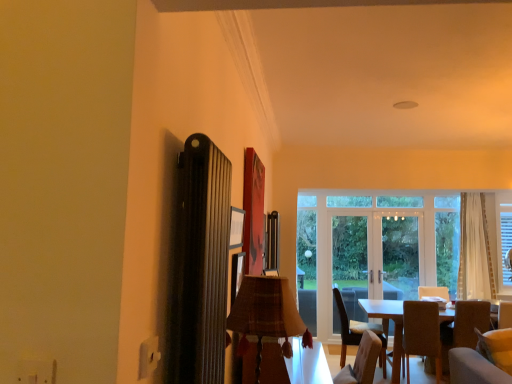
In order to click on plaid fabric lampshade at center in this screenshot , I will do 266,326.

Measure the distance between brown fabric chair at lower right, which is counted as the second chair, starting from the right, and camera.

The distance of brown fabric chair at lower right, which is counted as the second chair, starting from the right, from camera is 4.60 meters.

What is the approximate height of clear glass door at center, which is the first screen door in right-to-left order?

clear glass door at center, which is the first screen door in right-to-left order, is 2.08 meters in height.

In the scene shown: Measure the distance between point (498, 357) and camera.

The distance of point (498, 357) from camera is 11.61 feet.

In order to click on plaid fabric lampshade at center in this screenshot , I will do `click(266, 326)`.

Is plaid fabric lampshade at center located outside white sheer curtain at right?

Indeed, plaid fabric lampshade at center is completely outside white sheer curtain at right.

Is plaid fabric lampshade at center facing away from white sheer curtain at right?

No, plaid fabric lampshade at center is not facing the opposite direction of white sheer curtain at right.

Does point (262, 331) lie in front of point (472, 208)?

Yes, point (262, 331) is in front of point (472, 208).

The height and width of the screenshot is (384, 512). In order to click on curtain on the right of plaid fabric lampshade at center in this screenshot , I will do `click(474, 250)`.

Is there a large distance between soft beige fabric armchair at lower right and clear glass door at center, which is the second screen door from right to left?

Absolutely, soft beige fabric armchair at lower right is distant from clear glass door at center, which is the second screen door from right to left.

From the picture: How far apart are soft beige fabric armchair at lower right and clear glass door at center, which is the second screen door from right to left?

soft beige fabric armchair at lower right is 1.42 meters away from clear glass door at center, which is the second screen door from right to left.

From the picture: Which is in front, soft beige fabric armchair at lower right or clear glass door at center, which is the second screen door from right to left?

soft beige fabric armchair at lower right is in front.

Which object is wider, soft beige fabric armchair at lower right or clear glass door at center, which is counted as the 1th screen door, starting from the left?

soft beige fabric armchair at lower right.

The image size is (512, 384). Identify the location of couch lying in front of the clear glass door at center, which is the first screen door in right-to-left order. (484, 360).

Can you confirm if clear glass door at center, the 2th screen door viewed from the left, is smaller than velvet beige couch at lower right?

No, clear glass door at center, the 2th screen door viewed from the left, is not smaller than velvet beige couch at lower right.

From the image's perspective, is clear glass door at center, the 2th screen door viewed from the left, on top of velvet beige couch at lower right?

Yes, from the image's perspective, clear glass door at center, the 2th screen door viewed from the left, is over velvet beige couch at lower right.

Does point (414, 292) lie in front of point (463, 380)?

No.

Could you measure the distance between transparent glass window at center and clear glass door at center, which is counted as the 1th screen door, starting from the left?

1.14 meters.

Looking at this image, from a real-world perspective, is transparent glass window at center positioned over clear glass door at center, which is counted as the 1th screen door, starting from the left, based on gravity?

Indeed, from a real-world perspective, transparent glass window at center stands above clear glass door at center, which is counted as the 1th screen door, starting from the left.

Would you say transparent glass window at center is outside clear glass door at center, which is the second screen door from right to left?

Yes, transparent glass window at center is located beyond the bounds of clear glass door at center, which is the second screen door from right to left.

Based on their sizes in the image, would you say transparent glass window at center is bigger or smaller than clear glass door at center, which is counted as the 1th screen door, starting from the left?

Clearly, transparent glass window at center is smaller in size than clear glass door at center, which is counted as the 1th screen door, starting from the left.

Is plaid fabric lampshade at center not within transparent glass window at center?

plaid fabric lampshade at center lies outside transparent glass window at center's area.

From the image's perspective, would you say plaid fabric lampshade at center is positioned over transparent glass window at center?

Indeed, from the image's perspective, plaid fabric lampshade at center is shown above transparent glass window at center.

Is transparent glass window at center at the back of plaid fabric lampshade at center?

No.

From the picture: How different are the orientations of plaid fabric lampshade at center and transparent glass window at center in degrees?

93.5 degrees separate the facing orientations of plaid fabric lampshade at center and transparent glass window at center.

Visually, is transparent glass window at center positioned to the left or to the right of velvet beige couch at lower right?

Based on their positions, transparent glass window at center is located to the right of velvet beige couch at lower right.

From a real-world perspective, is transparent glass window at center physically located above or below velvet beige couch at lower right?

transparent glass window at center is situated higher than velvet beige couch at lower right in the real world.

This screenshot has width=512, height=384. In the image, there is a transparent glass window at center. What are the coordinates of `couch below it (from a real-world perspective)` in the screenshot? It's located at (484, 360).

From the picture: Could you tell me if dark wood table at lower right, positioned as the first table in back-to-front order, is facing soft beige fabric armchair at lower right?

Yes, dark wood table at lower right, positioned as the first table in back-to-front order, faces towards soft beige fabric armchair at lower right.

Considering the positions of points (366, 312) and (487, 321), is point (366, 312) closer to camera compared to point (487, 321)?

No.

In terms of size, does dark wood table at lower right, positioned as the first table in back-to-front order, appear bigger or smaller than soft beige fabric armchair at lower right?

Considering their sizes, dark wood table at lower right, positioned as the first table in back-to-front order, takes up more space than soft beige fabric armchair at lower right.

Considering the relative positions of dark wood table at lower right, the first table positioned from the right, and soft beige fabric armchair at lower right in the image provided, is dark wood table at lower right, the first table positioned from the right, to the right of soft beige fabric armchair at lower right from the viewer's perspective?

Incorrect, dark wood table at lower right, the first table positioned from the right, is not on the right side of soft beige fabric armchair at lower right.

You are a GUI agent. You are given a task and a screenshot of the screen. Output one action in this format:
    pyautogui.click(x=<x>, y=<y>)
    Task: Click on the lamp below the white sheer curtain at right (from a real-world perspective)
    The width and height of the screenshot is (512, 384).
    Given the screenshot: What is the action you would take?
    pyautogui.click(x=266, y=326)

At what (x,y) coordinates should I click in order to perform the action: click on the 2nd screen door behind when counting from the soft beige fabric armchair at lower right. Please return your answer as a coordinate pair (x, y). Looking at the image, I should click on (350, 262).

Estimate the real-world distances between objects in this image. Which object is closer to clear glass door at center, which is the first screen door in right-to-left order, clear glass door at center, which is counted as the 1th screen door, starting from the left, or velvet beige couch at lower right?

clear glass door at center, which is counted as the 1th screen door, starting from the left.

Based on their spatial positions, is plaid fabric table at center, which is the second table from right to left, or plaid fabric lampshade at center closer to clear glass door at center, the 2th screen door viewed from the left?

Among the two, plaid fabric table at center, which is the second table from right to left, is located nearer to clear glass door at center, the 2th screen door viewed from the left.

Based on their spatial positions, is white sheer curtain at right or transparent glass window at center closer to dark wood table at lower right, the second table from the left?

The object closer to dark wood table at lower right, the second table from the left, is transparent glass window at center.

Estimate the real-world distances between objects in this image. Which object is closer to clear glass door at center, the 2th screen door viewed from the left, plaid fabric lampshade at center or dark wood table at lower right, positioned as the first table in back-to-front order?

Among the two, dark wood table at lower right, positioned as the first table in back-to-front order, is located nearer to clear glass door at center, the 2th screen door viewed from the left.

From the image, which object appears to be nearer to white sheer curtain at right, plaid fabric lampshade at center or transparent glass window at center?

Based on the image, transparent glass window at center appears to be nearer to white sheer curtain at right.

Considering their positions, is white sheer curtain at right positioned further to dark wood table at lower right, the first table positioned from the right, than clear glass door at center, the 2th screen door viewed from the left?

The object further to dark wood table at lower right, the first table positioned from the right, is white sheer curtain at right.

Considering their positions, is plaid fabric table at center, the 1th table positioned from the left, positioned closer to transparent glass window at center than brown fabric chair at lower right, which appears as the first chair when viewed from the left?

The object closer to transparent glass window at center is brown fabric chair at lower right, which appears as the first chair when viewed from the left.

Looking at the image, which one is located further to transparent glass window at center, clear glass door at center, which is the first screen door in right-to-left order, or plaid fabric lampshade at center?

plaid fabric lampshade at center is positioned further to the anchor transparent glass window at center.

Locate an element on the screen. table positioned between soft beige fabric armchair at lower right and clear glass door at center, which is the second screen door from right to left, from near to far is located at coordinates (388, 325).

You are a GUI agent. You are given a task and a screenshot of the screen. Output one action in this format:
    pyautogui.click(x=<x>, y=<y>)
    Task: Click on the table situated between brown fabric chair at lower right, which is the second chair from left to right, and soft beige fabric armchair at lower right from left to right
    The image size is (512, 384).
    Given the screenshot: What is the action you would take?
    pyautogui.click(x=388, y=325)

I want to click on window between brown fabric chair at lower right, which is the second chair from left to right, and clear glass door at center, which is the second screen door from right to left, in the front-back direction, so click(x=447, y=241).

Locate an element on the screen. The height and width of the screenshot is (384, 512). chair between dark wood table at lower right, the second table from the left, and clear glass door at center, which is the first screen door in right-to-left order, from front to back is located at coordinates (357, 332).